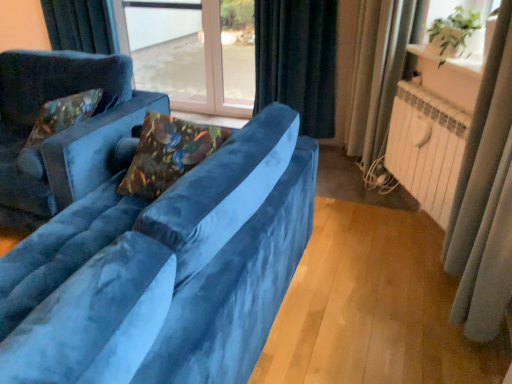
Question: Could velvet floral pillow at left, the first pillow in the left-to-right sequence, be considered to be inside green leafy plant at upper right, acting as the second window screen starting from the left?

Choices:
 (A) no
 (B) yes

Answer: (A)

Question: Considering the relative positions of green leafy plant at upper right, positioned as the first window screen in right-to-left order, and velvet floral pillow at left, the first pillow in the left-to-right sequence, in the image provided, is green leafy plant at upper right, positioned as the first window screen in right-to-left order, to the left of velvet floral pillow at left, the first pillow in the left-to-right sequence, from the viewer's perspective?

Choices:
 (A) no
 (B) yes

Answer: (A)

Question: From a real-world perspective, does green leafy plant at upper right, positioned as the first window screen in right-to-left order, stand above velvet floral pillow at left, marked as the 1th pillow in a back-to-front arrangement?

Choices:
 (A) no
 (B) yes

Answer: (B)

Question: Is green leafy plant at upper right, arranged as the second window screen when viewed from the back, taller than velvet floral pillow at left, the first pillow in the left-to-right sequence?

Choices:
 (A) yes
 (B) no

Answer: (B)

Question: Is green leafy plant at upper right, acting as the second window screen starting from the left, thinner than velvet floral pillow at left, arranged as the 2th pillow when viewed from the front?

Choices:
 (A) yes
 (B) no

Answer: (B)

Question: Is green leafy plant at upper right, arranged as the second window screen when viewed from the back, positioned with its back to velvet floral pillow at left, arranged as the 2th pillow when viewed from the front?

Choices:
 (A) yes
 (B) no

Answer: (B)

Question: From the image's perspective, is transparent glass window screen at center, placed as the 2th window screen when sorted from right to left, under velvet floral pillow at left, arranged as the 2th pillow when viewed from the front?

Choices:
 (A) no
 (B) yes

Answer: (A)

Question: Can you confirm if transparent glass window screen at center, which is the 1th window screen from back to front, is bigger than velvet floral pillow at left, the second pillow when ordered from right to left?

Choices:
 (A) no
 (B) yes

Answer: (A)

Question: Would you say transparent glass window screen at center, placed as the 2th window screen when sorted from right to left, is a long distance from velvet floral pillow at left, arranged as the 2th pillow when viewed from the front?

Choices:
 (A) yes
 (B) no

Answer: (A)

Question: Can you confirm if transparent glass window screen at center, which is the first window screen in left-to-right order, is positioned to the right of velvet floral pillow at left, marked as the 1th pillow in a back-to-front arrangement?

Choices:
 (A) yes
 (B) no

Answer: (A)

Question: Is transparent glass window screen at center, which ranks as the 2th window screen in front-to-back order, at the left side of velvet floral pillow at left, the second pillow when ordered from right to left?

Choices:
 (A) no
 (B) yes

Answer: (A)

Question: Is transparent glass window screen at center, which ranks as the 2th window screen in front-to-back order, oriented towards velvet floral pillow at left, arranged as the 2th pillow when viewed from the front?

Choices:
 (A) no
 (B) yes

Answer: (B)

Question: Does velvet floral pillow at center, placed as the first pillow when sorted from front to back, have a lesser width compared to green leafy plant at upper right, the first window screen viewed from the front?

Choices:
 (A) yes
 (B) no

Answer: (B)